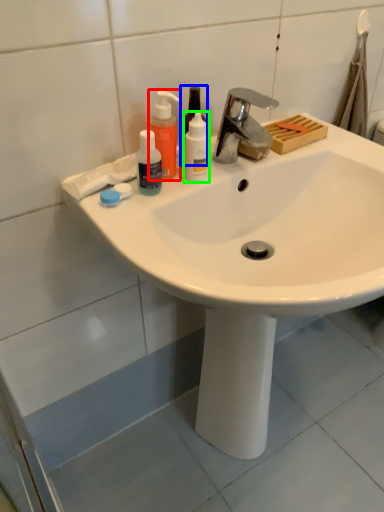
Question: Based on their relative distances, which object is farther from cleaning product (highlighted by a red box)? Choose from mouthwash (highlighted by a blue box) and mouthwash (highlighted by a green box).

Choices:
 (A) mouthwash
 (B) mouthwash

Answer: (B)